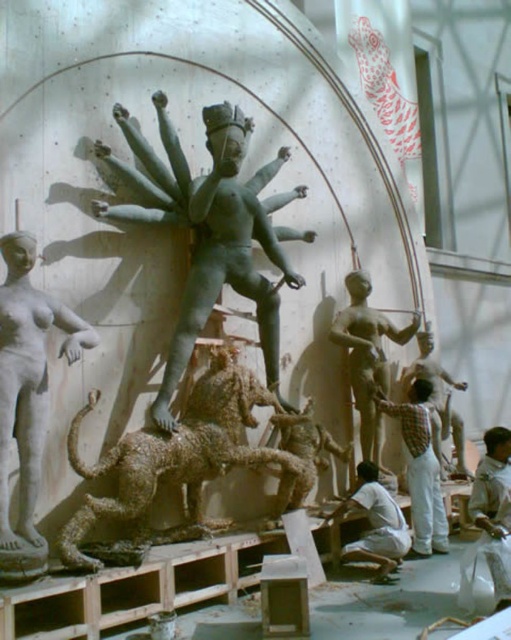
Question: Does bronze statue at center come behind matte gray statue at left?

Choices:
 (A) no
 (B) yes

Answer: (B)

Question: In this image, where is rusty wireframe horse at center located relative to plaid shirt at center?

Choices:
 (A) right
 (B) left

Answer: (B)

Question: Based on their relative distances, which object is nearer to the rusty wireframe horse at center?

Choices:
 (A) white cotton shirt at lower center
 (B) matte gray statue at left
 (C) bronze statue at right

Answer: (A)

Question: Which of the following is the farthest from the observer?

Choices:
 (A) (71, 340)
 (B) (188, 522)
 (C) (374, 515)

Answer: (C)

Question: Observing the image, what is the correct spatial positioning of plaid shirt at center in reference to white cotton shirt at lower center?

Choices:
 (A) right
 (B) left

Answer: (A)

Question: Which of the following is the farthest from the observer?

Choices:
 (A) plaid shirt at center
 (B) matte gray statue at left
 (C) bronze statue at center

Answer: (A)